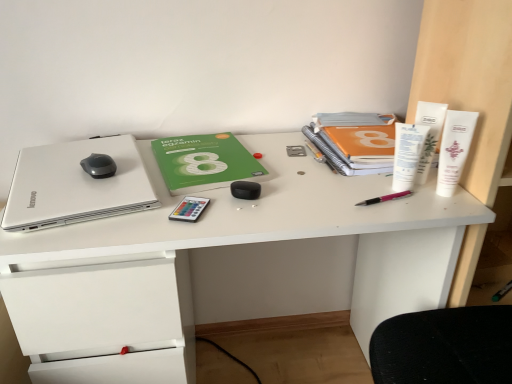
I want to click on vacant space situated above white matte laptop at left (from a real-world perspective), so click(73, 169).